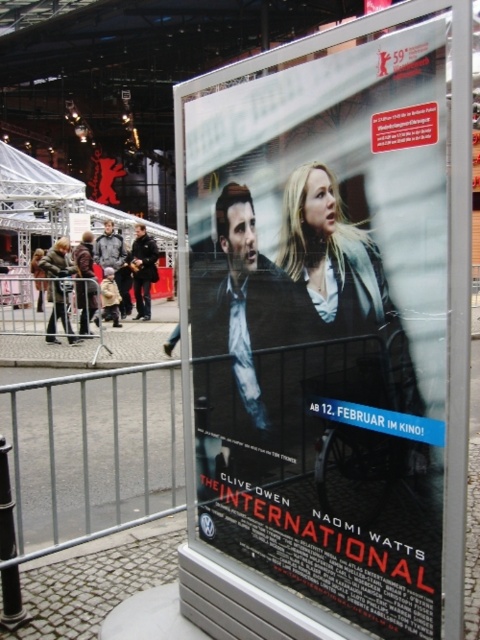
You are a photographer trying to capture both the metallic silver poster at center and the dark brown leather jacket at center in a single frame. Since the poster is larger, will you need to adjust your camera angle to include both subjects in the shot?

The metallic silver poster at center is bigger than the dark brown leather jacket at center, so you might need to adjust your camera angle to ensure both are fully visible in the frame.

You are an event organizer who needs to ensure that the metallic silver poster at center and the matte black suit at center are visible to attendees standing at the front of the event area. Given their heights, which object will require a taller stand to be displayed properly?

The metallic silver poster at center requires a taller stand because it has a greater height compared to the matte black suit at center.